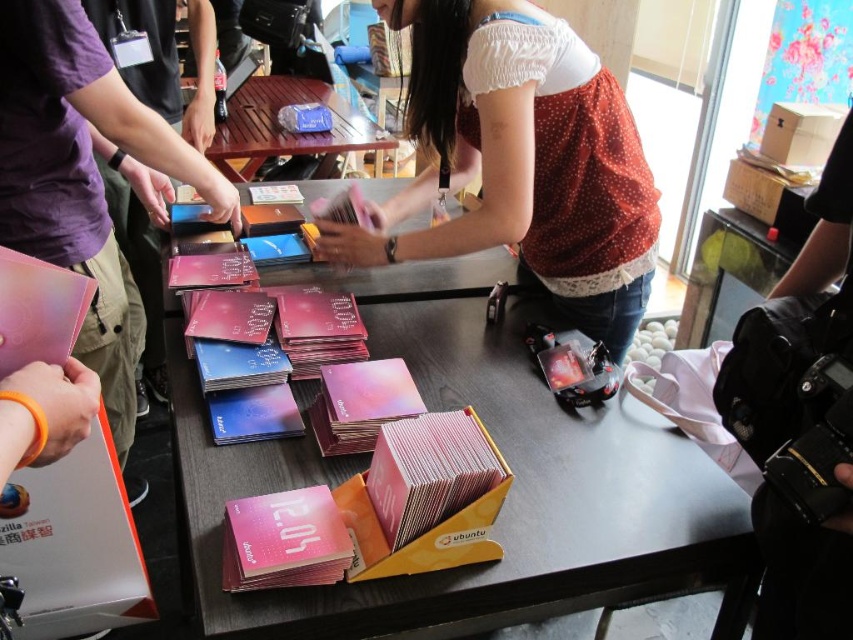
Does matte pink fabric at center have a smaller size compared to matte blue card at center?

No, matte pink fabric at center is not smaller than matte blue card at center.

Is matte pink fabric at center shorter than matte blue card at center?

In fact, matte pink fabric at center may be taller than matte blue card at center.

Between point (583, 106) and point (259, 417), which one is positioned in front?

Point (259, 417) is more forward.

Where is `matte pink fabric at center`? The image size is (853, 640). matte pink fabric at center is located at coordinates (521, 160).

Which is more to the left, pink matte card at lower left or pink glossy card at center?

pink glossy card at center

Does pink matte card at lower left have a smaller size compared to pink glossy card at center?

Correct, pink matte card at lower left occupies less space than pink glossy card at center.

What do you see at coordinates (38, 310) in the screenshot? Image resolution: width=853 pixels, height=640 pixels. I see `pink matte card at lower left` at bounding box center [38, 310].

The image size is (853, 640). In order to click on pink matte card at lower left in this screenshot , I will do `click(38, 310)`.

Does pink glossy book at center have a greater width compared to matte black book at center?

Yes.

Does point (201, 288) come closer to viewer compared to point (247, 232)?

Yes, point (201, 288) is in front of point (247, 232).

Does point (193, 259) lie in front of point (252, 230)?

Yes, point (193, 259) is in front of point (252, 230).

Locate an element on the screen. This screenshot has height=640, width=853. pink glossy book at center is located at coordinates [210, 269].